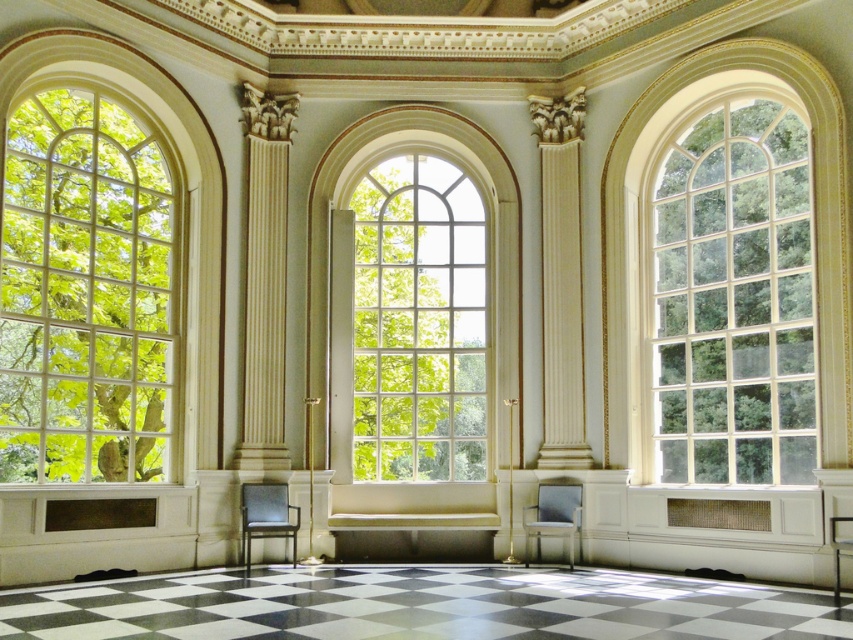
Question: Is clear glass window at left positioned before clear glass window at right?

Choices:
 (A) yes
 (B) no

Answer: (A)

Question: Is clear glass window at left closer to camera compared to clear glass window at right?

Choices:
 (A) no
 (B) yes

Answer: (B)

Question: Does clear glass window at right have a larger size compared to clear glass window at center?

Choices:
 (A) no
 (B) yes

Answer: (B)

Question: Which object appears closest to the camera in this image?

Choices:
 (A) clear glass window at left
 (B) clear glass window at right

Answer: (A)

Question: Which point is farther from the camera taking this photo?

Choices:
 (A) (693, 289)
 (B) (456, 269)

Answer: (B)

Question: Which object is the closest to the clear glass window at center?

Choices:
 (A) clear glass window at right
 (B) clear glass window at left

Answer: (A)